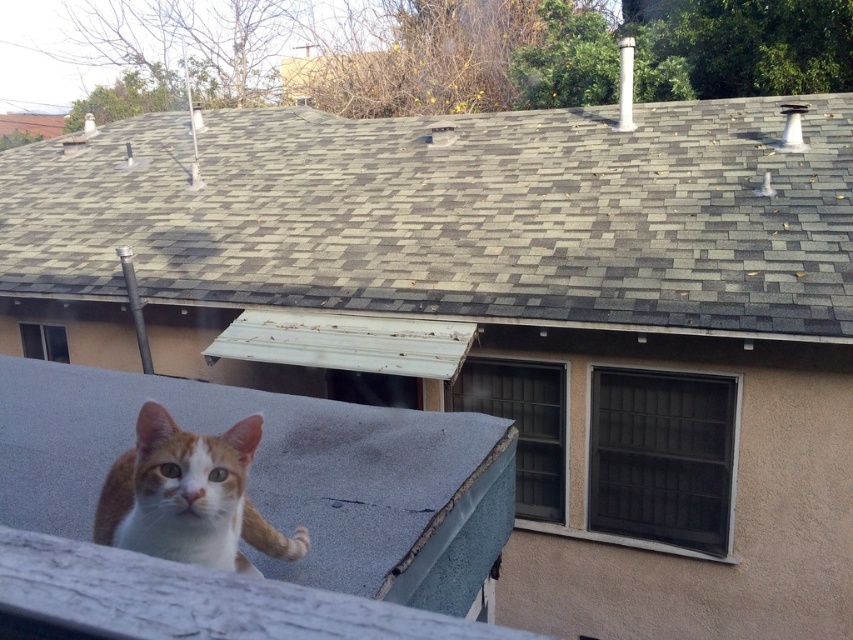
Question: Can you confirm if gray shingles at upper center is thinner than orange tabby cat at lower left?

Choices:
 (A) no
 (B) yes

Answer: (A)

Question: Considering the relative positions of gray shingles at upper center and orange tabby cat at lower left in the image provided, where is gray shingles at upper center located with respect to orange tabby cat at lower left?

Choices:
 (A) above
 (B) below

Answer: (A)

Question: Which object appears farthest from the camera in this image?

Choices:
 (A) gray shingles at upper center
 (B) orange tabby cat at lower left

Answer: (A)

Question: Which point is farther to the camera?

Choices:
 (A) gray shingles at upper center
 (B) orange tabby cat at lower left

Answer: (A)

Question: Is gray shingles at upper center to the right of orange tabby cat at lower left from the viewer's perspective?

Choices:
 (A) no
 (B) yes

Answer: (A)

Question: Which object appears closest to the camera in this image?

Choices:
 (A) orange tabby cat at lower left
 (B) gray shingles at upper center

Answer: (A)